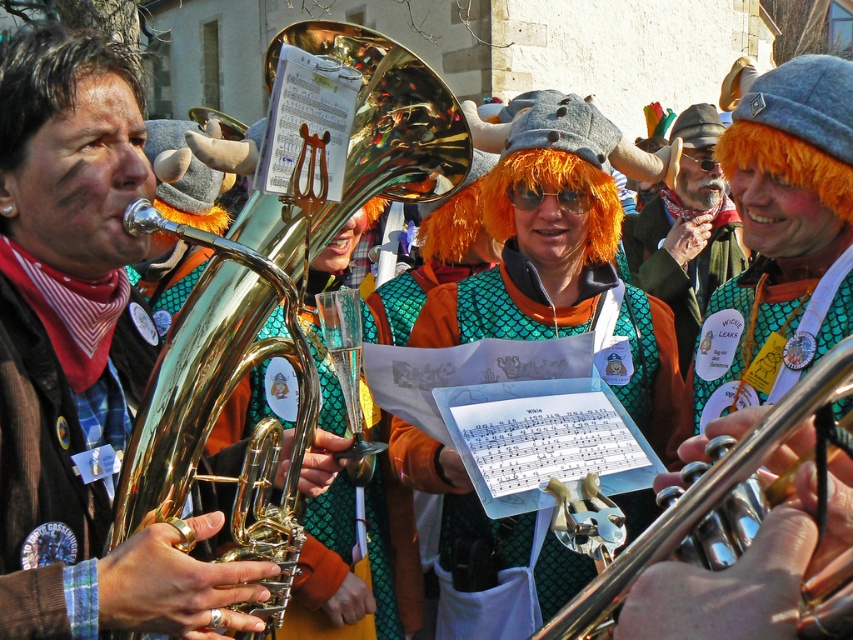
In the festive scene, there are people in colorful costumes and tubas. The orange wig at center is represented by point [688,230]. Where is the orange wig located in the image?

The orange wig at center is located at point [688,230] in the image.

You are standing at the origin point in the scene. Which of the two points, point (286,28) or point (699,273), is closer to you?

Point (286,28) is closer to you because it is in front of point (699,273).